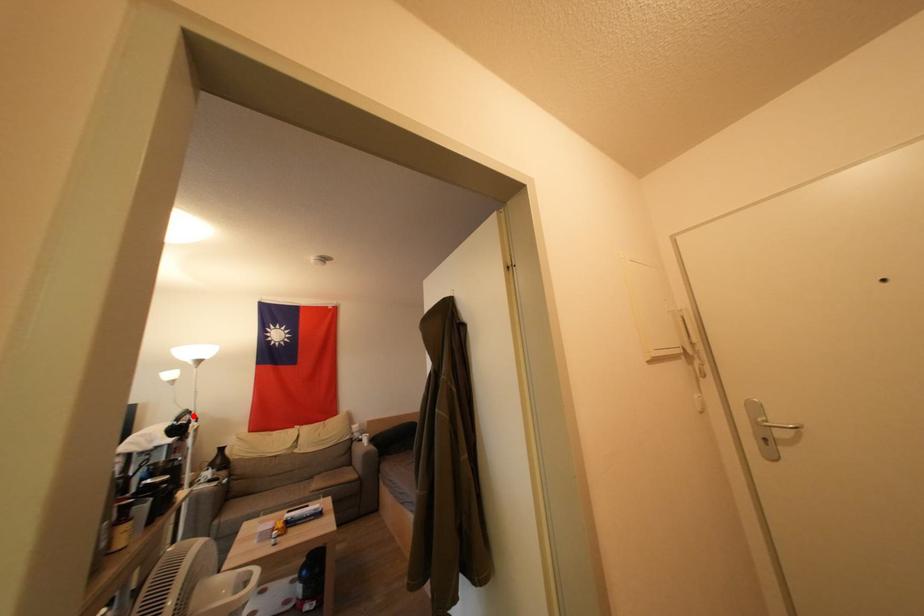
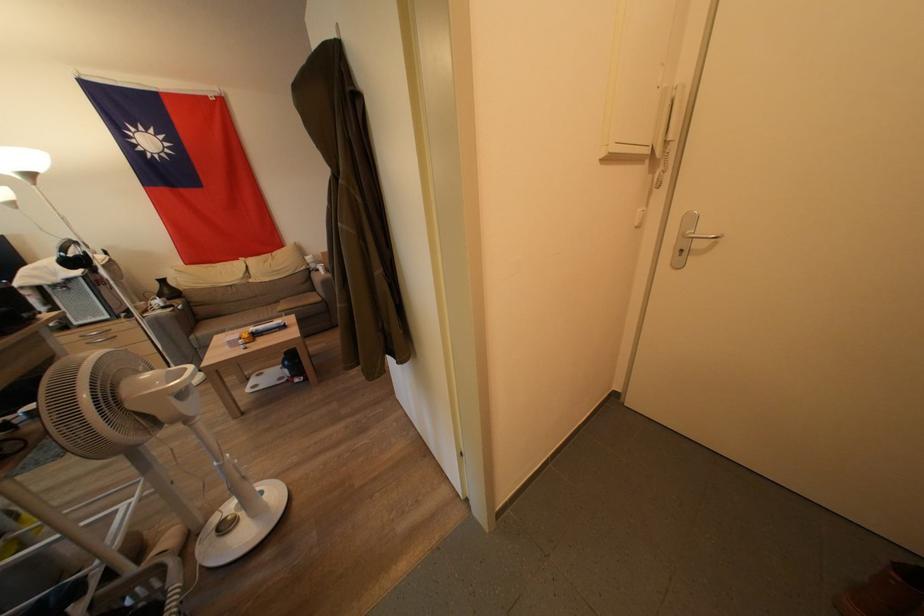
Where in the second image is the point corresponding to the highlighted location from the first image?

(79, 246)